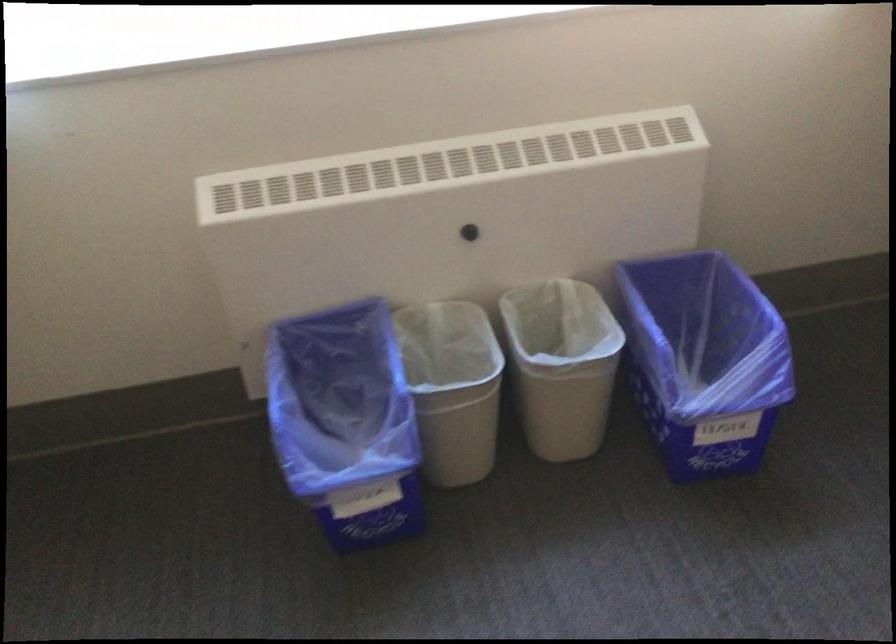
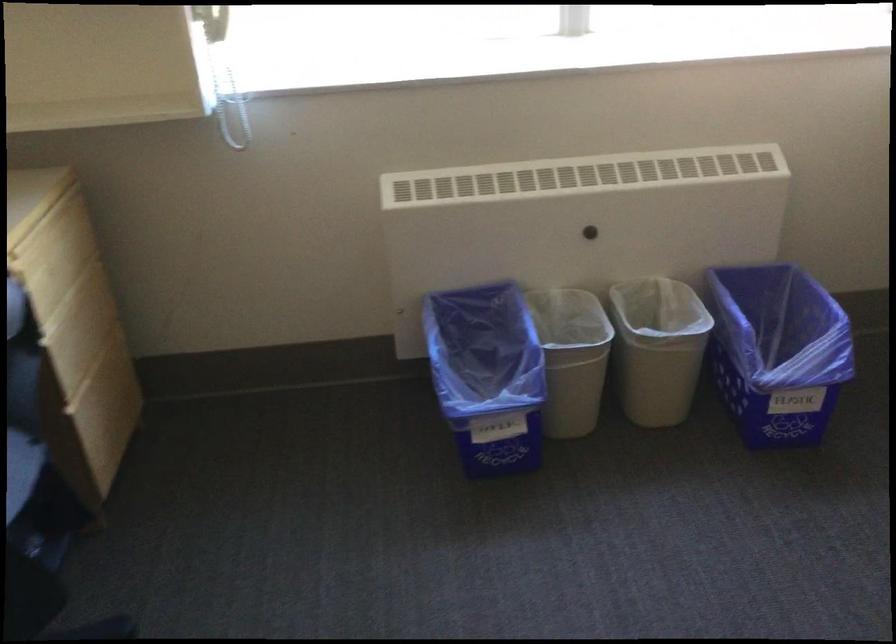
Locate, in the second image, the point that corresponds to point 469,234 in the first image.

(590, 232)